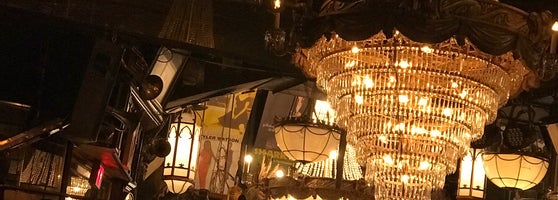
This screenshot has height=200, width=558. In order to click on to the left of the ceiling lights in this screenshot , I will do `click(9, 156)`.